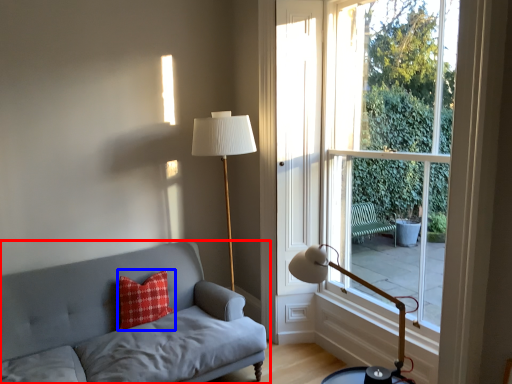
Question: Among these objects, which one is farthest to the camera, studio couch (highlighted by a red box) or pillow (highlighted by a blue box)?

Choices:
 (A) studio couch
 (B) pillow

Answer: (B)